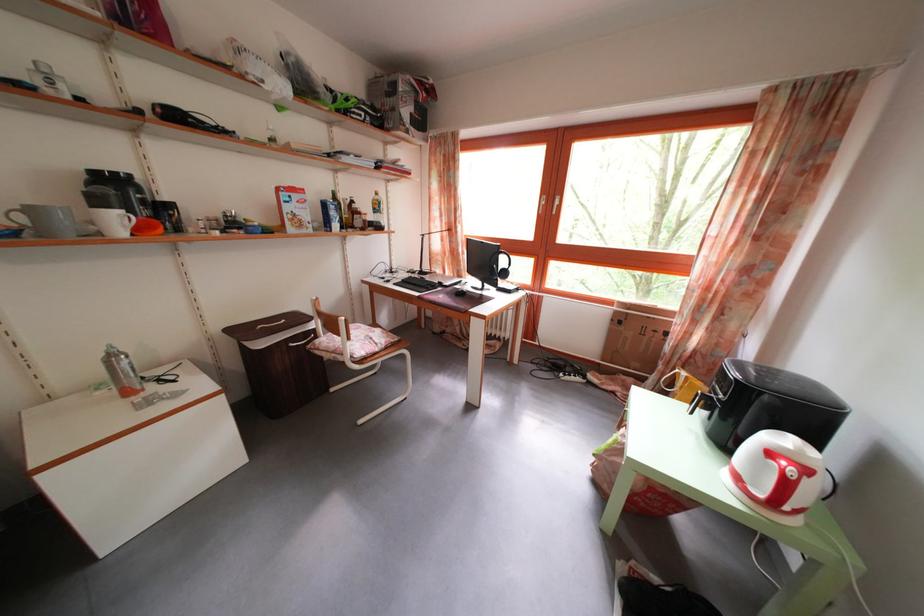
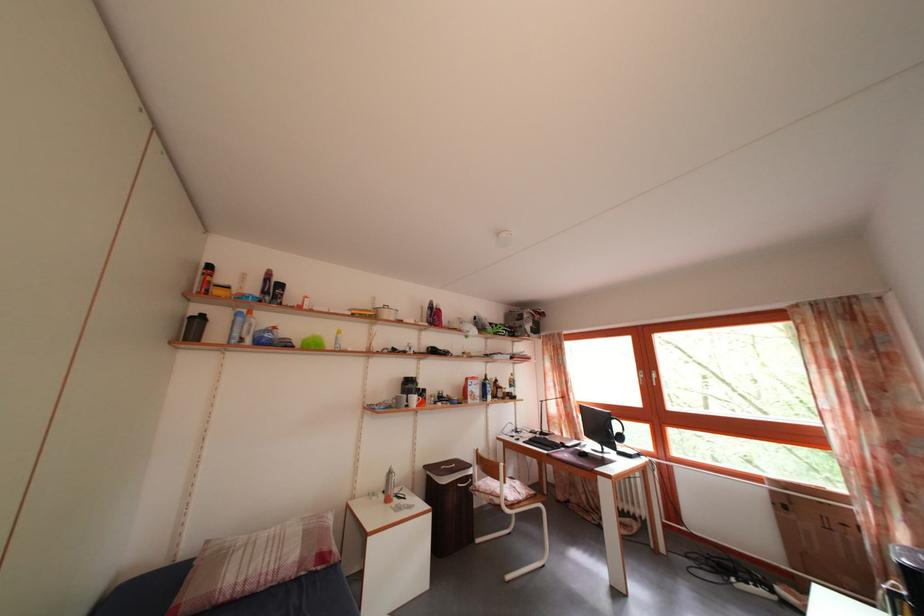
Where in the second image is the point corresponding to (x=511, y=269) from the first image?

(624, 434)